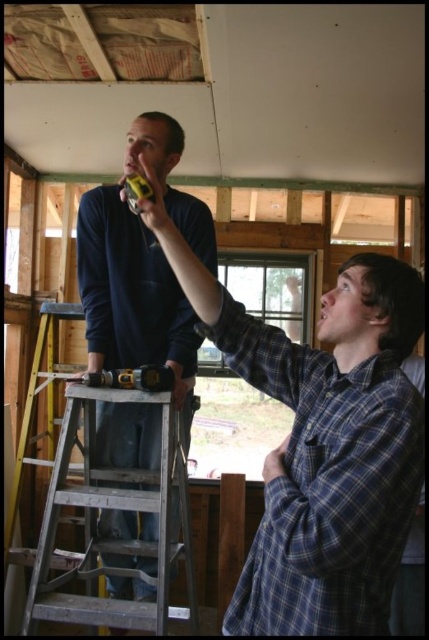
Who is positioned more to the right, blue plaid shirt at upper center or silver metallic ladder at left?

blue plaid shirt at upper center is more to the right.

Which is behind, point (359, 468) or point (36, 340)?

The point (36, 340) is more distant.

This screenshot has width=429, height=640. What do you see at coordinates (323, 442) in the screenshot?
I see `blue plaid shirt at upper center` at bounding box center [323, 442].

I want to click on blue plaid shirt at upper center, so click(x=323, y=442).

From the picture: Can you confirm if blue plaid shirt at upper center is taller than yellow plastic drill at center?

Indeed, blue plaid shirt at upper center has a greater height compared to yellow plastic drill at center.

Does blue plaid shirt at upper center have a lesser width compared to yellow plastic drill at center?

No.

Which is in front, point (374, 356) or point (163, 376)?

Positioned in front is point (374, 356).

The image size is (429, 640). In order to click on blue plaid shirt at upper center in this screenshot , I will do `click(323, 442)`.

Between silver metallic ladder at left and yellow plastic drill at center, which one is positioned higher?

yellow plastic drill at center

Does silver metallic ladder at left appear over yellow plastic drill at center?

No.

Measure the distance between point (105,490) and camera.

Point (105,490) is 5.46 feet away from camera.

Locate an element on the screen. silver metallic ladder at left is located at coordinates (93, 500).